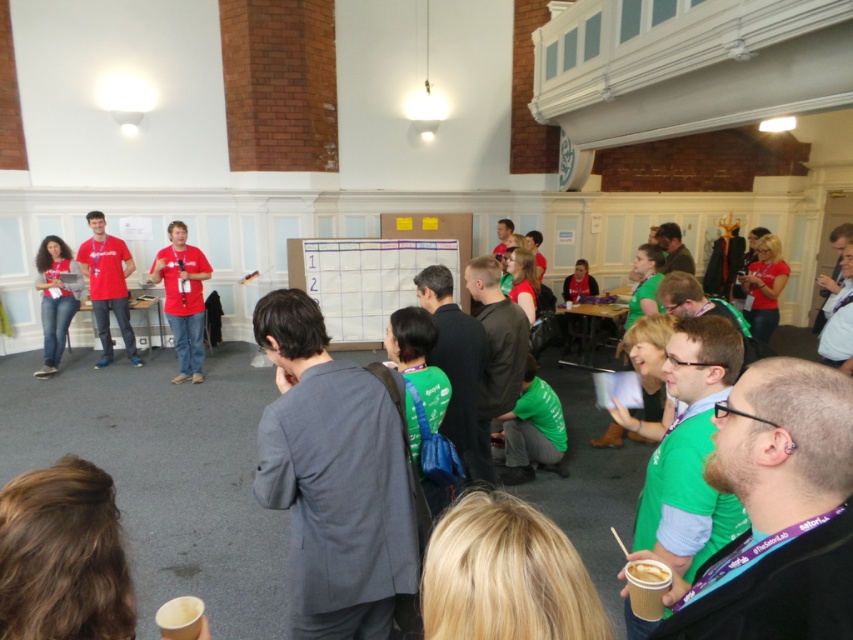
This screenshot has width=853, height=640. I want to click on matte red shirt at left, so click(107, 285).

Can you confirm if matte red shirt at center is thinner than matte red shirt at left?

Correct, matte red shirt at center's width is less than matte red shirt at left's.

Between matte red shirt at center and matte red shirt at left, which one appears on the left side from the viewer's perspective?

matte red shirt at left

What are the coordinates of `matte red shirt at center` in the screenshot? It's located at (183, 298).

Find the location of a particular element. Image resolution: width=853 pixels, height=640 pixels. matte red shirt at center is located at coordinates (183, 298).

What do you see at coordinates (183, 298) in the screenshot? I see `matte red shirt at center` at bounding box center [183, 298].

Is matte red shirt at center behind jeans at left?

No, it is not.

The height and width of the screenshot is (640, 853). In order to click on matte red shirt at center in this screenshot , I will do `click(183, 298)`.